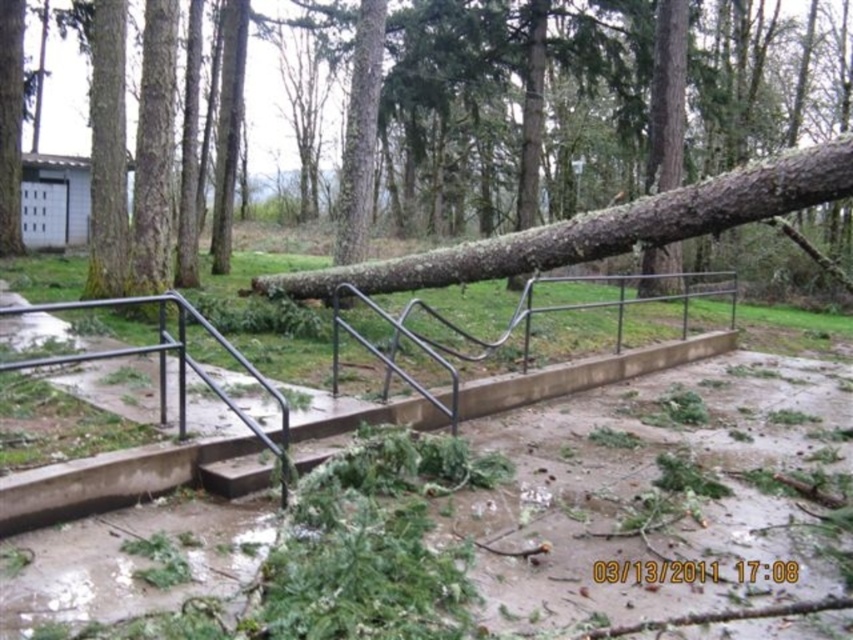
Can you confirm if brown rough bark tree at center is shorter than black metal rail at center?

No.

Can you confirm if brown rough bark tree at center is bigger than black metal rail at center?

Yes, brown rough bark tree at center is bigger than black metal rail at center.

The width and height of the screenshot is (853, 640). In order to click on brown rough bark tree at center in this screenshot , I will do `click(618, 205)`.

Locate an element on the screen. The height and width of the screenshot is (640, 853). brown rough bark tree at center is located at coordinates (618, 205).